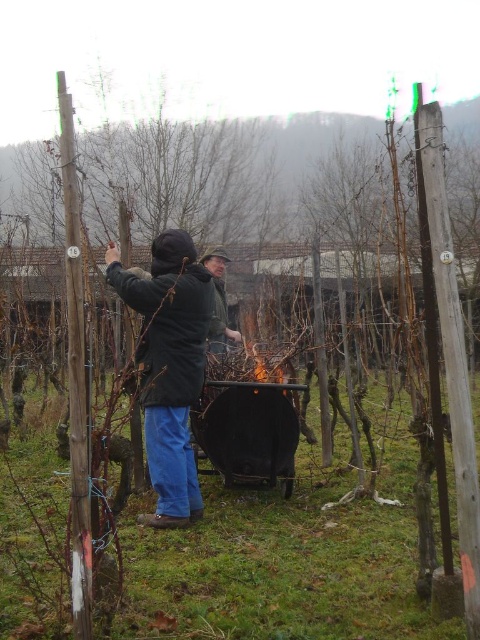
You are planning to take a photo of both the dark blue jacket at center and the green matte jacket at center. Since you want to ensure both are in focus, you need to know which one is taller. Which jacket is taller?

The dark blue jacket at center is taller than the green matte jacket at center according to the description.

You are planning to take a photo of both the dark blue jacket at center and the green matte jacket at center. Which jacket should you focus on first if you want to capture both in a single frame without moving the camera?

The dark blue jacket at center is bigger than the green matte jacket at center, so you should focus on the dark blue jacket at center first to ensure it fits properly in the frame.

You are a photographer trying to capture a photo of both the dark blue jacket at center and the green matte jacket at center in the same frame. Based on their positions, which jacket should you focus on first to ensure both are in the shot?

The dark blue jacket at center is to the left of the green matte jacket at center, so you should focus on the dark blue jacket at center first to ensure both are in the shot.